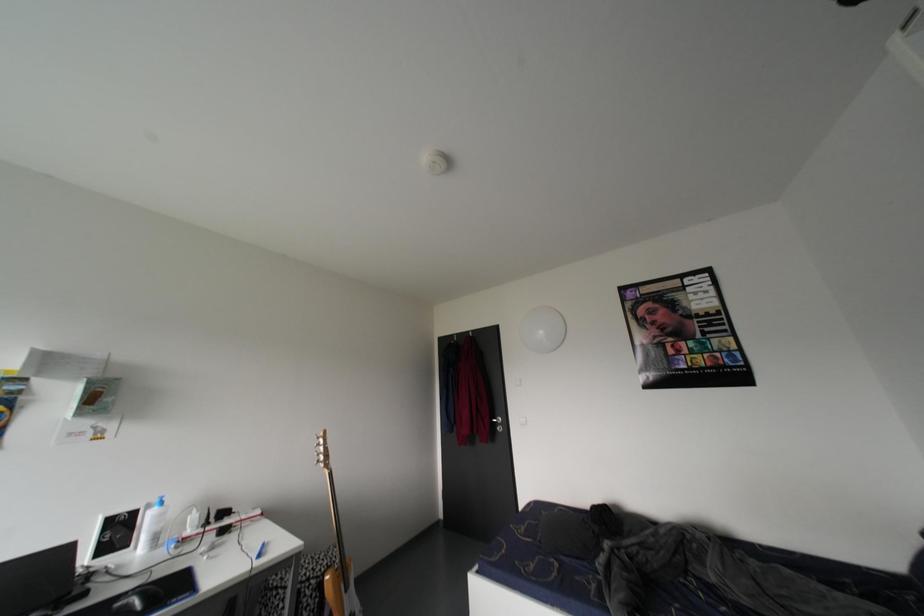
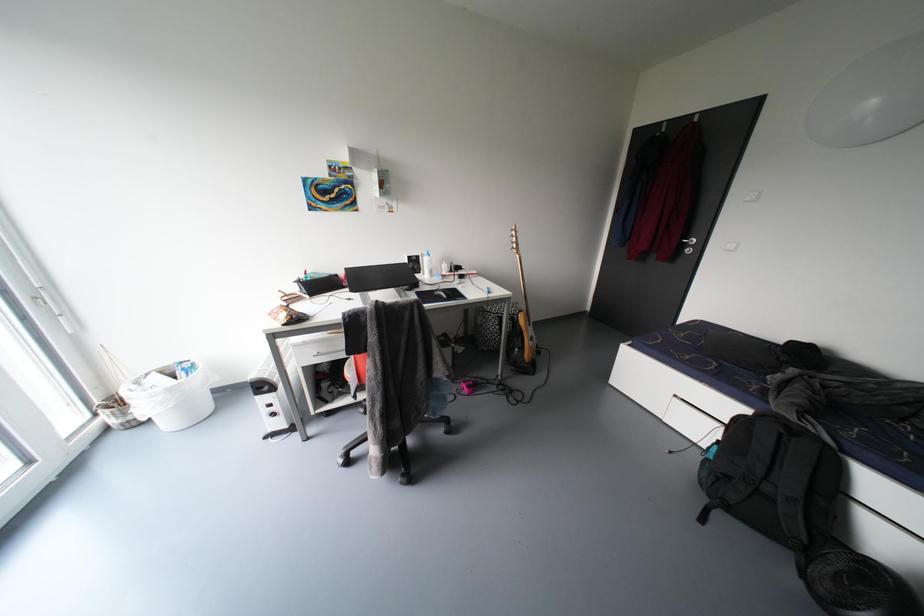
How did the camera likely rotate?

The camera rotated toward left-down.